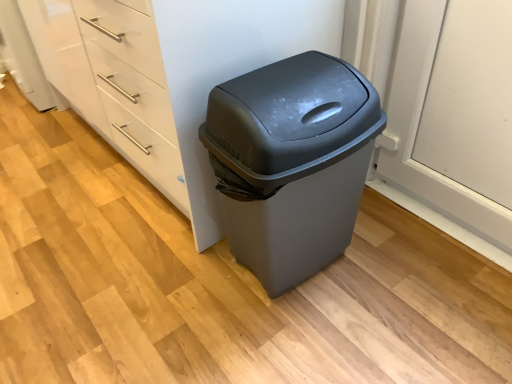
Identify the location of free space to the right of matte gray plastic trash can at center. (406, 273).